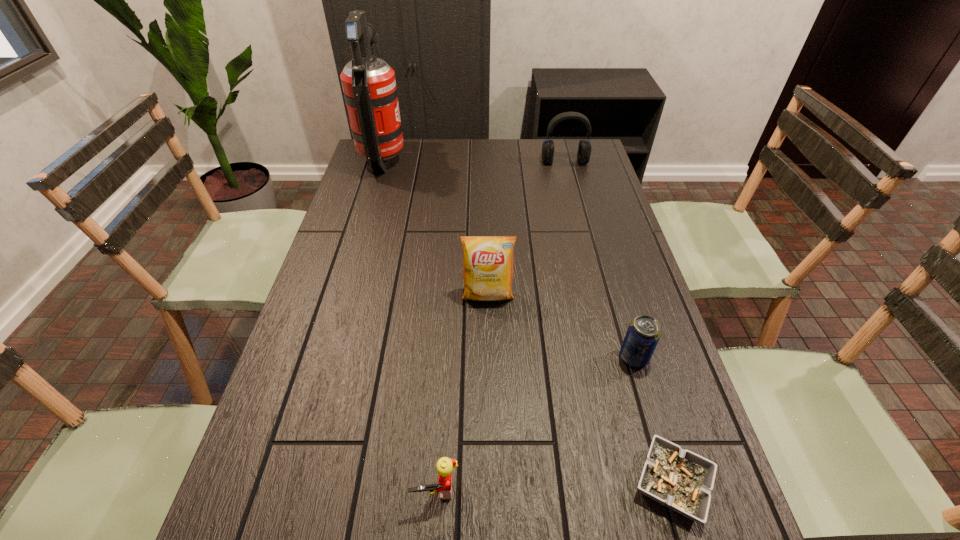
Locate an element on the screen. Image resolution: width=960 pixels, height=540 pixels. free space located on the back of the soda is located at coordinates (610, 273).

Locate an element on the screen. Image resolution: width=960 pixels, height=540 pixels. vacant space located on the back of the shortest object is located at coordinates (617, 298).

This screenshot has height=540, width=960. In order to click on fire extinguisher located in the far edge section of the desktop in this screenshot , I will do `click(369, 86)`.

The width and height of the screenshot is (960, 540). In order to click on headset that is at the far edge in this screenshot , I will do [584, 149].

What are the coordinates of `object positioned at the left edge` in the screenshot? It's located at (369, 86).

At what (x,y) coordinates should I click in order to perform the action: click on headset that is at the right edge. Please return your answer as a coordinate pair (x, y). This screenshot has height=540, width=960. Looking at the image, I should click on (584, 149).

Identify the location of soda present at the right edge. (644, 332).

Find the location of a particular element. ashtray that is positioned at the right edge is located at coordinates (681, 480).

What are the coordinates of `object located in the far left corner section of the desktop` in the screenshot? It's located at (369, 86).

I want to click on object at the far right corner, so click(x=584, y=149).